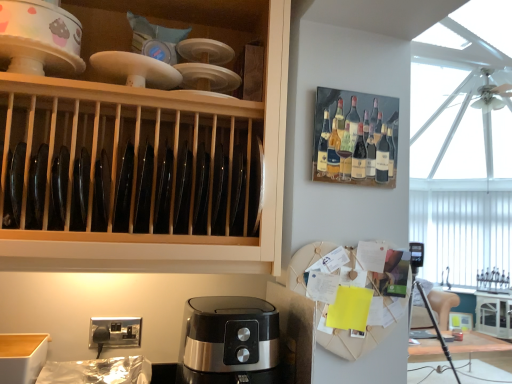
Question: Considering the relative positions of satin black coffee maker at lower center and matte ceramic bowl at upper left in the image provided, is satin black coffee maker at lower center to the left or to the right of matte ceramic bowl at upper left?

Choices:
 (A) right
 (B) left

Answer: (A)

Question: Is satin black coffee maker at lower center wider or thinner than matte ceramic bowl at upper left?

Choices:
 (A) wide
 (B) thin

Answer: (A)

Question: Estimate the real-world distances between objects in this image. Which object is closer to the matte ceramic bowl at upper left?

Choices:
 (A) wooden plate rack at upper right
 (B) white glossy cabinet at right, the first cabinetry in the bottom-to-top sequence
 (C) black matte cabinet at upper left, the 2th cabinetry positioned from the right
 (D) satin black coffee maker at lower center

Answer: (C)

Question: Which object is the farthest from the satin black coffee maker at lower center?

Choices:
 (A) matte ceramic bowl at upper left
 (B) black matte cabinet at upper left, arranged as the 1th cabinetry when viewed from the left
 (C) wooden plate rack at upper right
 (D) white glossy cabinet at right, arranged as the first cabinetry when viewed from the back

Answer: (D)